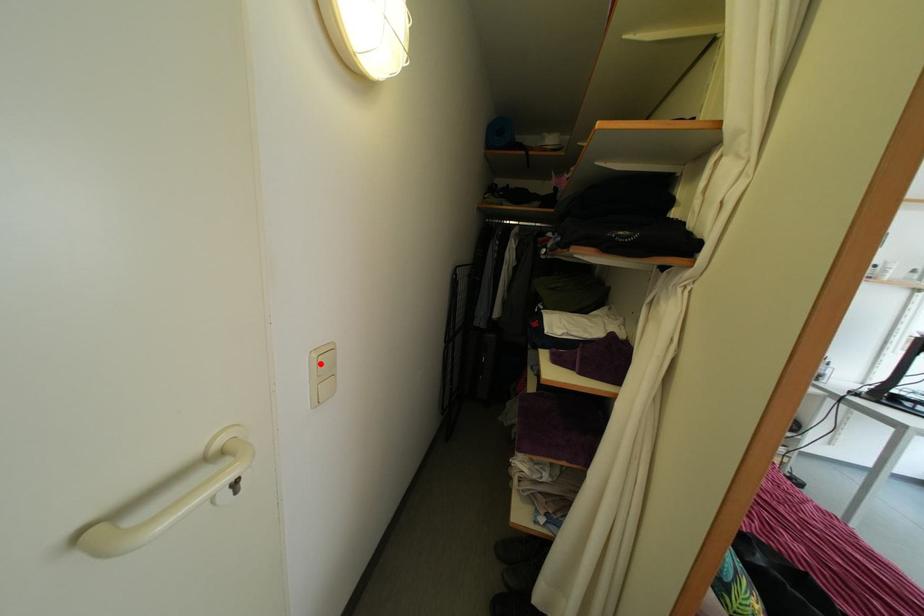
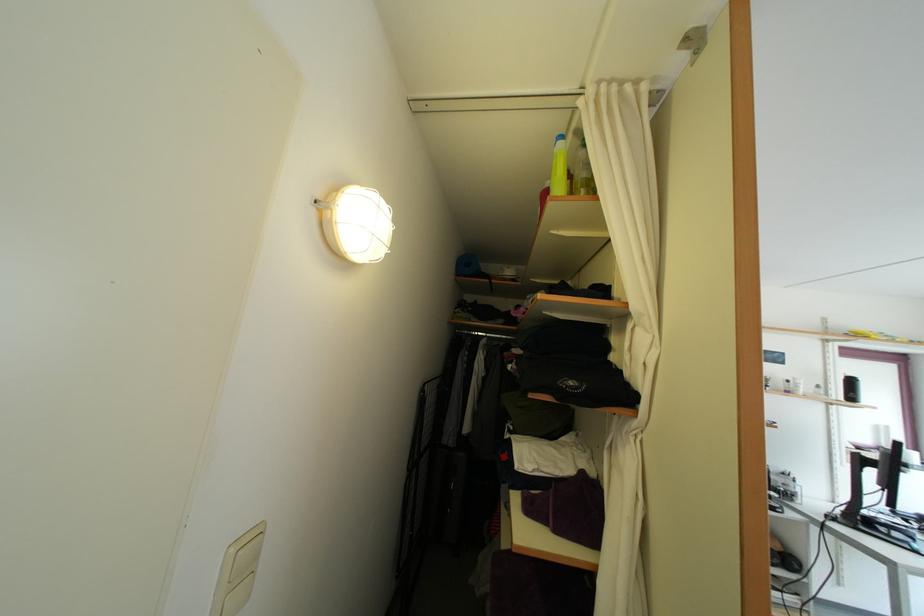
The point at the highlighted location is marked in the first image. Where is the corresponding point in the second image?

(239, 559)